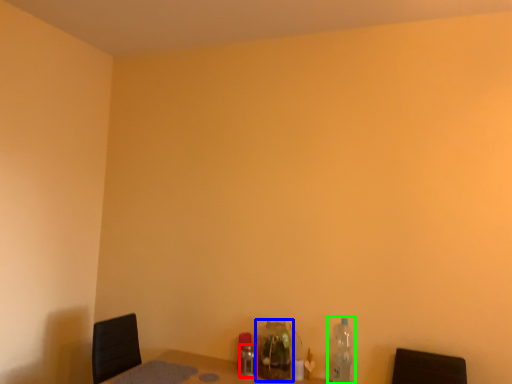
Question: Which object is positioned closest to bottle (highlighted by a red box)? Select from bottle (highlighted by a blue box) and bottle (highlighted by a green box).

Choices:
 (A) bottle
 (B) bottle

Answer: (A)